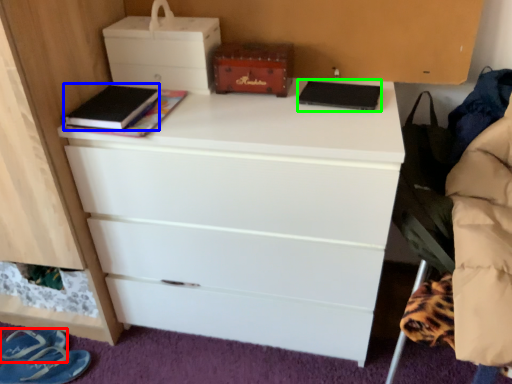
Question: Which is nearer to the footwear (highlighted by a red box)? book (highlighted by a blue box) or book (highlighted by a green box).

Choices:
 (A) book
 (B) book

Answer: (A)